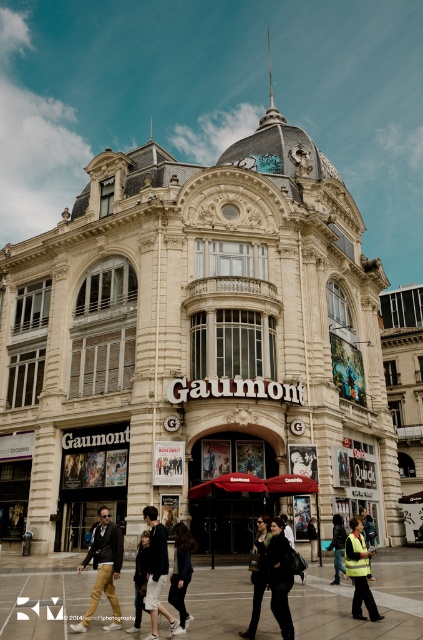
Question: Among these objects, which one is farthest from the camera?

Choices:
 (A) black leather jacket at center
 (B) dark blue denim jacket at center
 (C) reflective yellow vest at center
 (D) matte black jacket at center

Answer: (C)

Question: Which object appears farthest from the camera in this image?

Choices:
 (A) black leather jacket at center
 (B) white cotton pants at lower center
 (C) dark blue denim jacket at center

Answer: (C)

Question: Can you confirm if khaki cotton pants at center is positioned below matte black jacket at center?

Choices:
 (A) no
 (B) yes

Answer: (A)

Question: Which of the following is the closest to the observer?

Choices:
 (A) (252, 628)
 (B) (159, 605)
 (C) (99, 515)

Answer: (A)

Question: From the image, what is the correct spatial relationship of white cotton pants at lower center in relation to dark blue denim jacket at center?

Choices:
 (A) above
 (B) below

Answer: (A)

Question: Does black leather jacket at center come in front of white cotton pants at lower center?

Choices:
 (A) no
 (B) yes

Answer: (B)